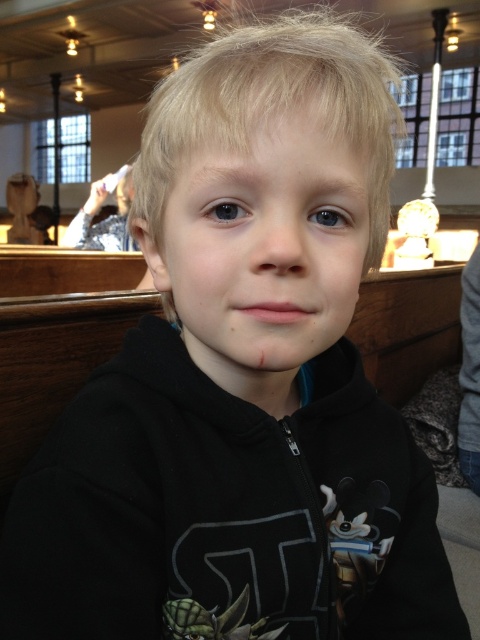
Question: Which point is farther from the camera taking this photo?

Choices:
 (A) coord(133,241)
 (B) coord(250,266)

Answer: (A)

Question: Which object appears closest to the camera in this image?

Choices:
 (A) smooth skin face at center
 (B) silver metallic statue at upper left

Answer: (A)

Question: Can you confirm if smooth skin face at center is thinner than silver metallic statue at upper left?

Choices:
 (A) yes
 (B) no

Answer: (A)

Question: Among these points, which one is nearest to the camera?

Choices:
 (A) (83, 241)
 (B) (262, 380)

Answer: (B)

Question: Where is smooth skin face at center located in relation to silver metallic statue at upper left in the image?

Choices:
 (A) above
 (B) below

Answer: (B)

Question: Does smooth skin face at center have a lesser width compared to silver metallic statue at upper left?

Choices:
 (A) no
 (B) yes

Answer: (B)